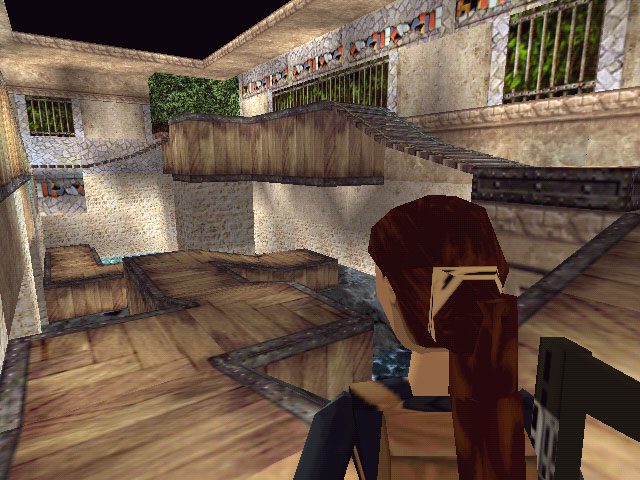
Find the location of `stairs`. stairs is located at coordinates (461, 160).